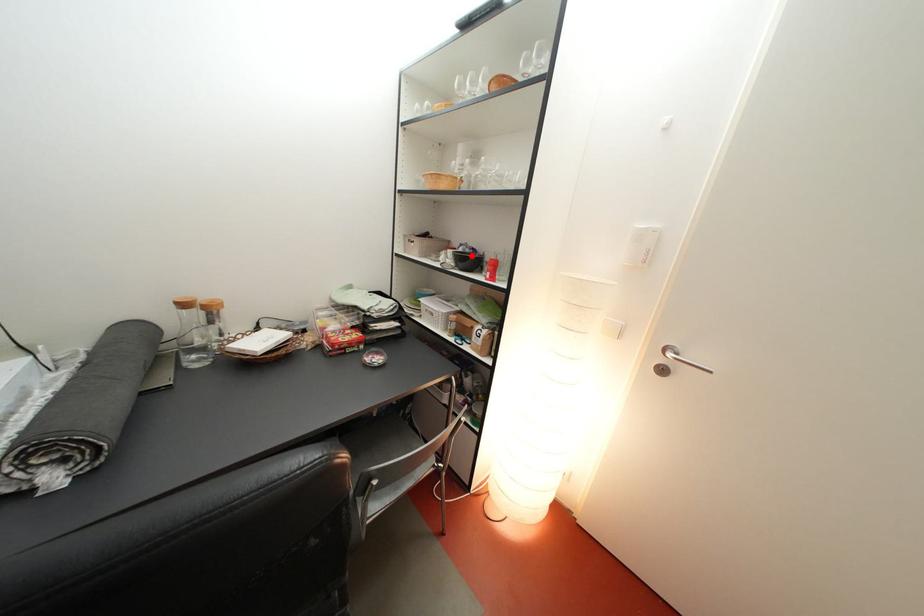
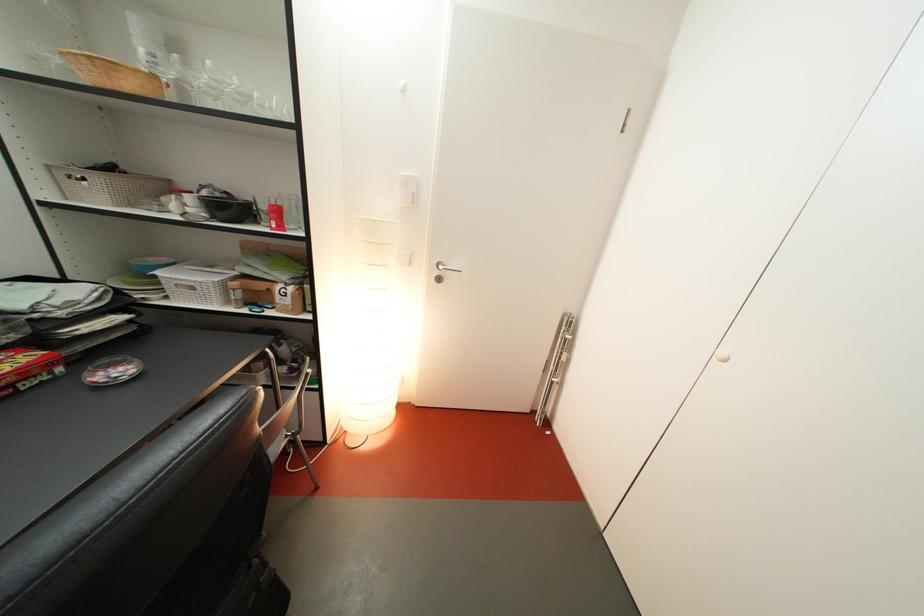
Locate, in the second image, the point that corresponds to the highlighted location in the first image.

(216, 200)